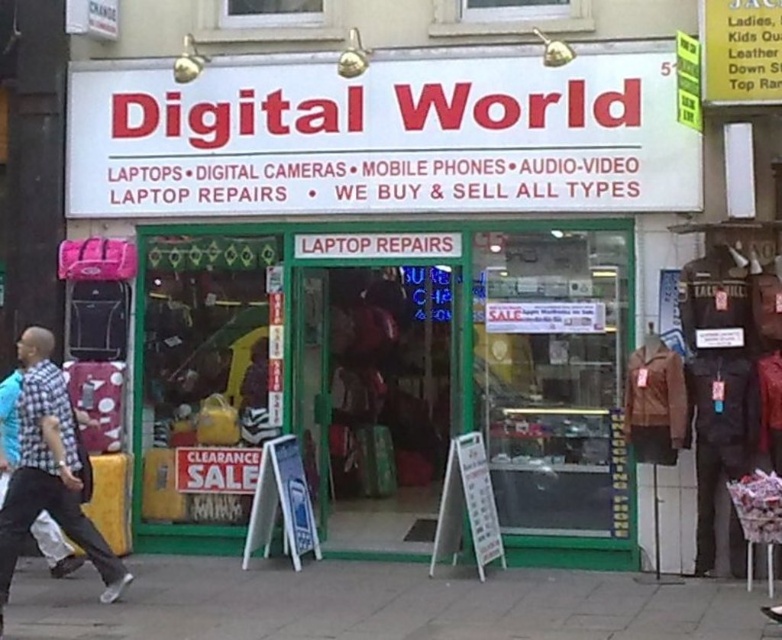
You are a delivery person who needs to place a heavy box on the ground. You see the leather jacket at center and the gray concrete pavement at lower center. Which surface should you choose to place the box?

The gray concrete pavement at lower center is the appropriate surface to place the heavy box since the leather jacket at center is positioned over it and likely belongs to a customer.

You are standing in front of the Digital World store and need to place a large shipping box that is 2 meters long on the gray concrete pavement at lower center. Can you fit the box entirely on the pavement without it extending beyond its edges?

The gray concrete pavement at lower center is 21.85 feet from viewer. Since 21.85 feet is approximately 6.66 meters, which is longer than the 2 meters of the shipping box, the box can be placed entirely on the pavement without extending beyond its edges.